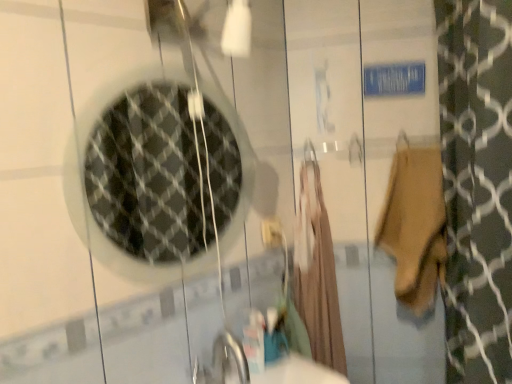
Question: Is clear glass mirror at upper left spatially inside beige cotton towel at right, or outside of it?

Choices:
 (A) outside
 (B) inside

Answer: (A)

Question: Considering the positions of point (161, 82) and point (410, 251), is point (161, 82) closer or farther from the camera than point (410, 251)?

Choices:
 (A) farther
 (B) closer

Answer: (B)

Question: Considering the real-world distances, which object is farthest from the beige fabric robe at center?

Choices:
 (A) white plastic electric outlet at center
 (B) clear glass mirror at upper left
 (C) beige cotton towel at right

Answer: (B)

Question: Estimate the real-world distances between objects in this image. Which object is closer to the beige fabric robe at center?

Choices:
 (A) clear glass mirror at upper left
 (B) white plastic electric outlet at center
 (C) beige cotton towel at right

Answer: (B)